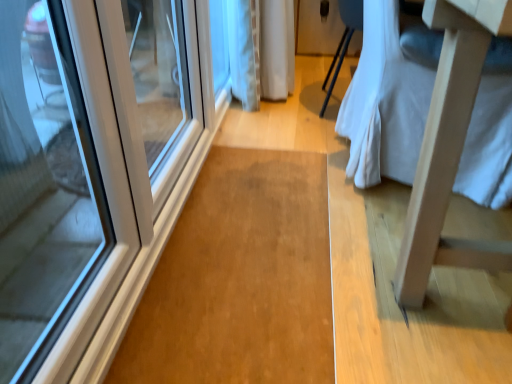
Question: Does white glossy door at left have a larger size compared to light wood changing table at right?

Choices:
 (A) yes
 (B) no

Answer: (B)

Question: From a real-world perspective, does white glossy door at left stand above light wood changing table at right?

Choices:
 (A) yes
 (B) no

Answer: (B)

Question: Is white glossy door at left facing away from light wood changing table at right?

Choices:
 (A) no
 (B) yes

Answer: (A)

Question: Is white glossy door at left facing towards light wood changing table at right?

Choices:
 (A) no
 (B) yes

Answer: (B)

Question: Is white glossy door at left thinner than light wood changing table at right?

Choices:
 (A) no
 (B) yes

Answer: (B)

Question: From the image's perspective, does white glossy door at left appear higher than light wood changing table at right?

Choices:
 (A) yes
 (B) no

Answer: (B)

Question: From the image's perspective, is light wood changing table at right beneath white glossy door at left?

Choices:
 (A) yes
 (B) no

Answer: (B)

Question: Considering the relative positions of light wood changing table at right and white glossy door at left in the image provided, is light wood changing table at right to the right of white glossy door at left from the viewer's perspective?

Choices:
 (A) yes
 (B) no

Answer: (A)

Question: Is light wood changing table at right further to camera compared to white glossy door at left?

Choices:
 (A) yes
 (B) no

Answer: (B)

Question: Is light wood changing table at right oriented away from white glossy door at left?

Choices:
 (A) yes
 (B) no

Answer: (A)

Question: Are light wood changing table at right and white glossy door at left far apart?

Choices:
 (A) yes
 (B) no

Answer: (A)

Question: Considering the relative sizes of light wood changing table at right and white glossy door at left in the image provided, is light wood changing table at right wider than white glossy door at left?

Choices:
 (A) yes
 (B) no

Answer: (A)

Question: Looking at their shapes, would you say light wood changing table at right is wider or thinner than white glossy door at left?

Choices:
 (A) thin
 (B) wide

Answer: (B)